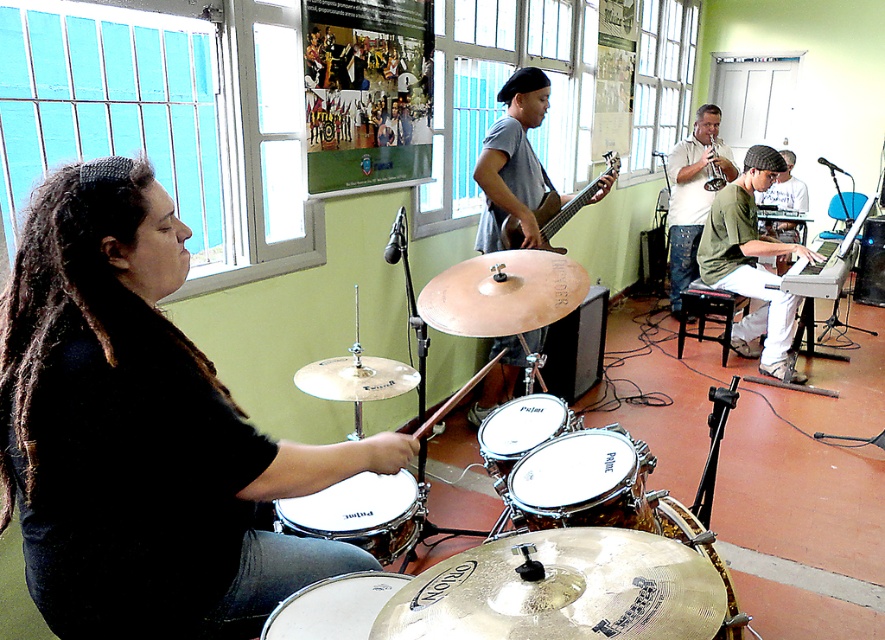
Question: Does matte gray shirt at upper right have a smaller size compared to brushed metal trumpet at upper right?

Choices:
 (A) no
 (B) yes

Answer: (A)

Question: Is black matte drum set at left positioned at the back of green matte keyboard at center right?

Choices:
 (A) yes
 (B) no

Answer: (B)

Question: Among these objects, which one is farthest from the camera?

Choices:
 (A) black matte drum set at left
 (B) brushed metal trumpet at upper right
 (C) white matte drum at lower center

Answer: (B)

Question: Which object is the closest to the white leather drum at lower left?

Choices:
 (A) white matte drum at lower center
 (B) white drumhead at center
 (C) matte gray shirt at upper right

Answer: (A)

Question: Which point is farther to the camera?

Choices:
 (A) (706, 140)
 (B) (722, 182)
 (C) (517, 96)

Answer: (A)

Question: Does black matte drum set at left appear on the right side of green matte keyboard at center right?

Choices:
 (A) yes
 (B) no

Answer: (B)